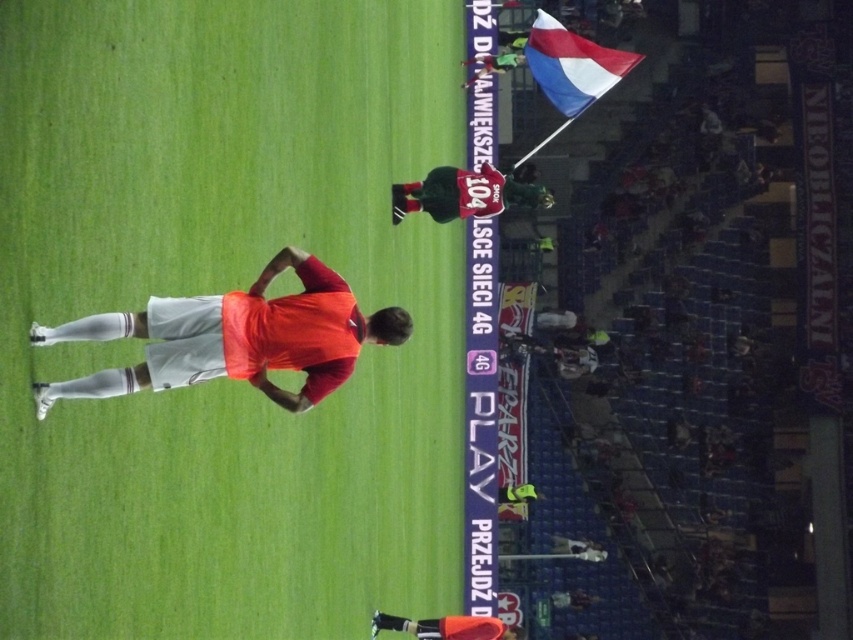
Question: Considering the relative positions of dark green jersey at upper center and orange jersey at upper center in the image provided, where is dark green jersey at upper center located with respect to orange jersey at upper center?

Choices:
 (A) below
 (B) above

Answer: (A)

Question: Is red and white fabric flag at upper right to the left of orange matte shorts at lower center from the viewer's perspective?

Choices:
 (A) no
 (B) yes

Answer: (A)

Question: Which object is the farthest from the orange jersey at upper center?

Choices:
 (A) matte orange shirt at center
 (B) red and white fabric flag at upper right

Answer: (A)

Question: Does red and white fabric flag at upper right have a smaller size compared to dark green jersey at upper center?

Choices:
 (A) no
 (B) yes

Answer: (A)

Question: Which point is closer to the camera?

Choices:
 (A) matte orange shirt at center
 (B) red and white fabric flag at upper right
 (C) orange matte shorts at lower center
 (D) dark green jersey at upper center

Answer: (A)

Question: Which of the following is the closest to the observer?

Choices:
 (A) dark green jersey at upper center
 (B) orange jersey at upper center
 (C) red and white fabric flag at upper right

Answer: (A)